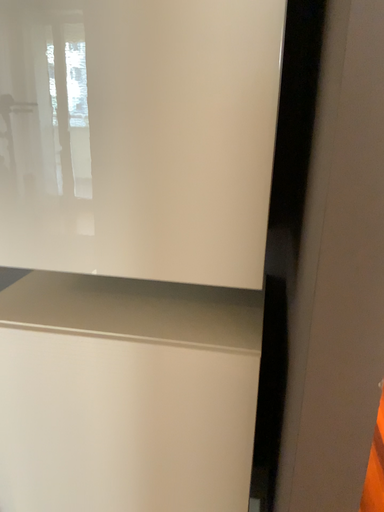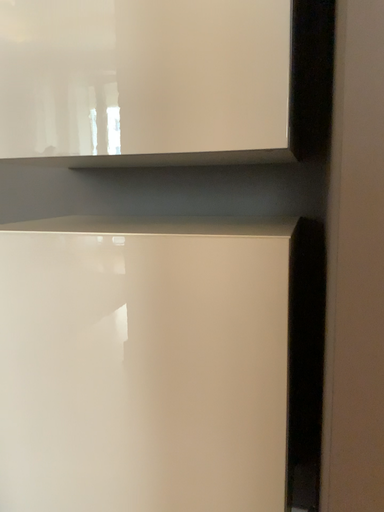
Question: How did the camera likely rotate when shooting the video?

Choices:
 (A) rotated upward
 (B) rotated downward

Answer: (A)